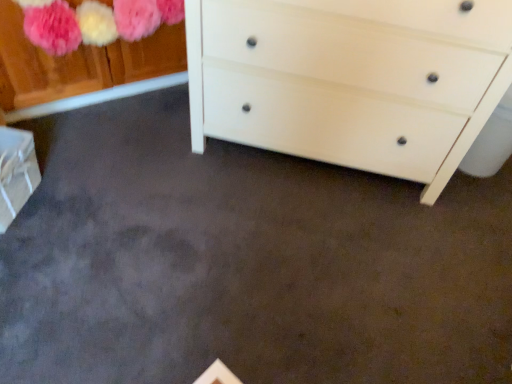
In order to click on vacant space to the right of white cardboard box at lower left in this screenshot , I will do `click(70, 209)`.